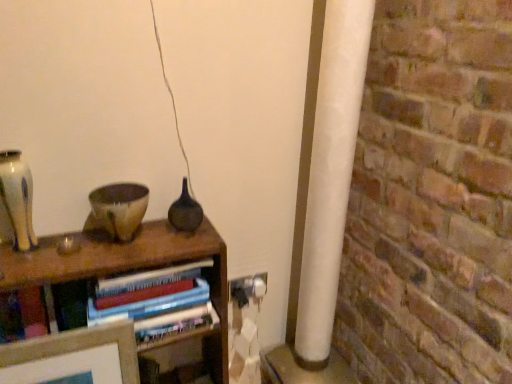
This screenshot has width=512, height=384. Find the location of `vacant area that is in front of matte beige vase at left, arranged as the 2th glass vase when viewed from the right`. vacant area that is in front of matte beige vase at left, arranged as the 2th glass vase when viewed from the right is located at coordinates pyautogui.click(x=19, y=270).